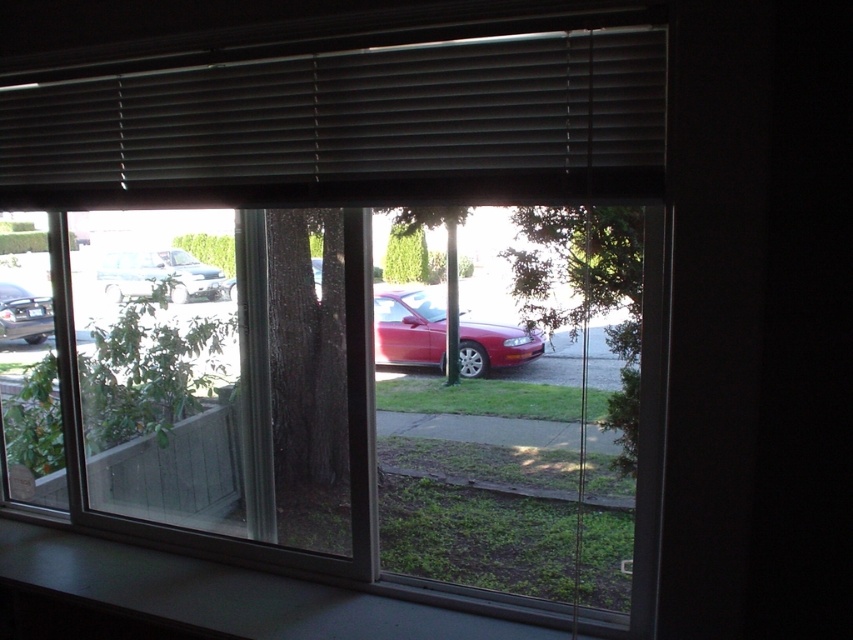
Between green leafy tree at center and shiny black sedan at left, which one has more height?

With more height is green leafy tree at center.

Which is behind, point (529, 305) or point (42, 312)?

The point (42, 312) is more distant.

Identify the location of green leafy tree at center. This screenshot has height=640, width=853. (585, 291).

Who is higher up, matte silver sedan at left or shiny black sedan at left?

matte silver sedan at left is above.

Is matte silver sedan at left further to the viewer compared to shiny black sedan at left?

No, it is in front of shiny black sedan at left.

Where is `matte silver sedan at left`? matte silver sedan at left is located at coordinates (158, 275).

Which is below, green leafy tree at center or glossy red car at center?

glossy red car at center is below.

Is green leafy tree at center to the right of glossy red car at center from the viewer's perspective?

Indeed, green leafy tree at center is positioned on the right side of glossy red car at center.

Who is more forward, (x=595, y=282) or (x=515, y=356)?

Point (x=595, y=282)

The width and height of the screenshot is (853, 640). Find the location of `green leafy tree at center`. green leafy tree at center is located at coordinates (585, 291).